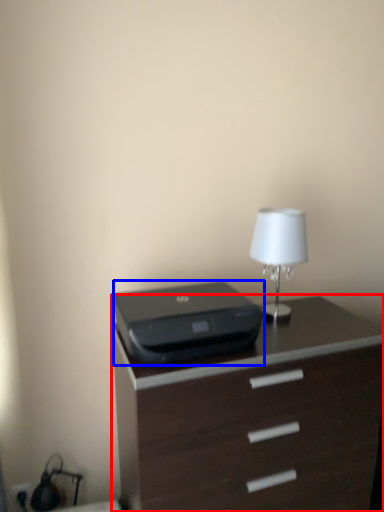
Question: Which object appears closest to the camera in this image, chest of drawers (highlighted by a red box) or printer (highlighted by a blue box)?

Choices:
 (A) chest of drawers
 (B) printer

Answer: (A)